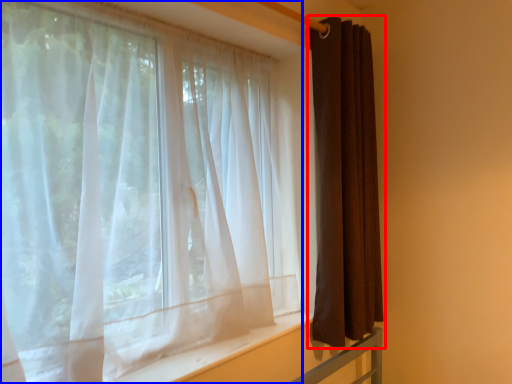
Question: Among these objects, which one is nearest to the camera, curtain (highlighted by a red box) or curtain (highlighted by a blue box)?

Choices:
 (A) curtain
 (B) curtain

Answer: (B)